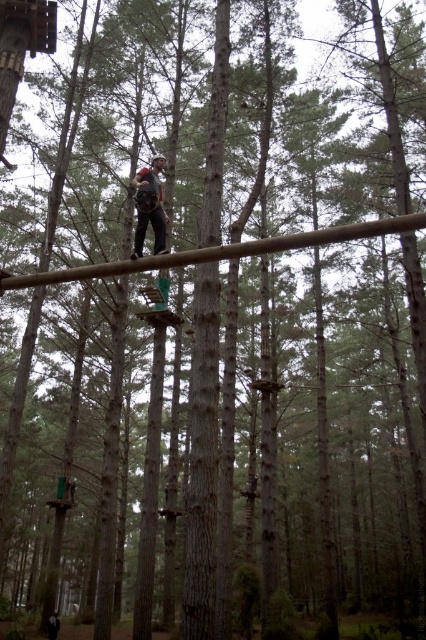
You are an adventure guide assessing safety equipment placement for a participant. The participant is wearing a dark brown leather jacket at lower left and has a matte gray helmet at center. Based on the scene, is the helmet positioned correctly to protect the head?

The matte gray helmet at center is positioned over the dark brown leather jacket at lower left, which means it is correctly placed on the participant head, providing proper protection.

You are an adventure guide assessing safety gear for a client. The client has a matte gray helmet at center and a dark brown leather jacket at lower left. Which piece of equipment is more suitable for ensuring head protection?

The matte gray helmet at center is larger in size than the dark brown leather jacket at lower left, making it the appropriate choice for head protection as helmets are designed to cover and protect the head, while jackets are meant for body warmth and do not provide head safety.